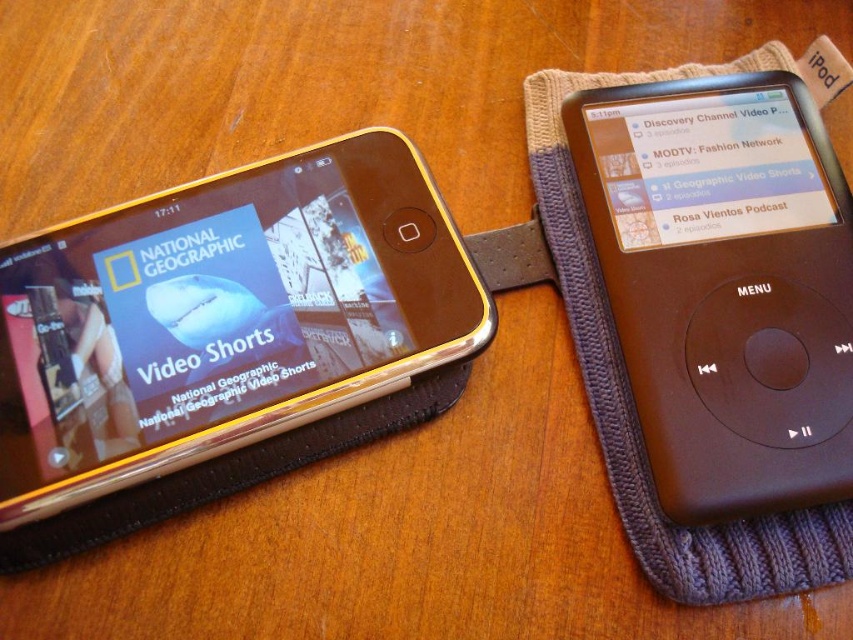
Question: Which of the following is the farthest from the observer?

Choices:
 (A) (804, 253)
 (B) (248, 244)

Answer: (B)

Question: Can you confirm if gold metallic smartphone at left is positioned above black matte ipod at right?

Choices:
 (A) yes
 (B) no

Answer: (B)

Question: Which point is closer to the camera?

Choices:
 (A) (318, 173)
 (B) (737, 276)

Answer: (B)

Question: In this image, where is gold metallic smartphone at left located relative to black matte ipod at right?

Choices:
 (A) left
 (B) right

Answer: (A)

Question: Considering the relative positions of gold metallic smartphone at left and black matte ipod at right in the image provided, where is gold metallic smartphone at left located with respect to black matte ipod at right?

Choices:
 (A) above
 (B) below

Answer: (B)

Question: Among these objects, which one is nearest to the camera?

Choices:
 (A) gold metallic smartphone at left
 (B) black matte ipod at right

Answer: (A)